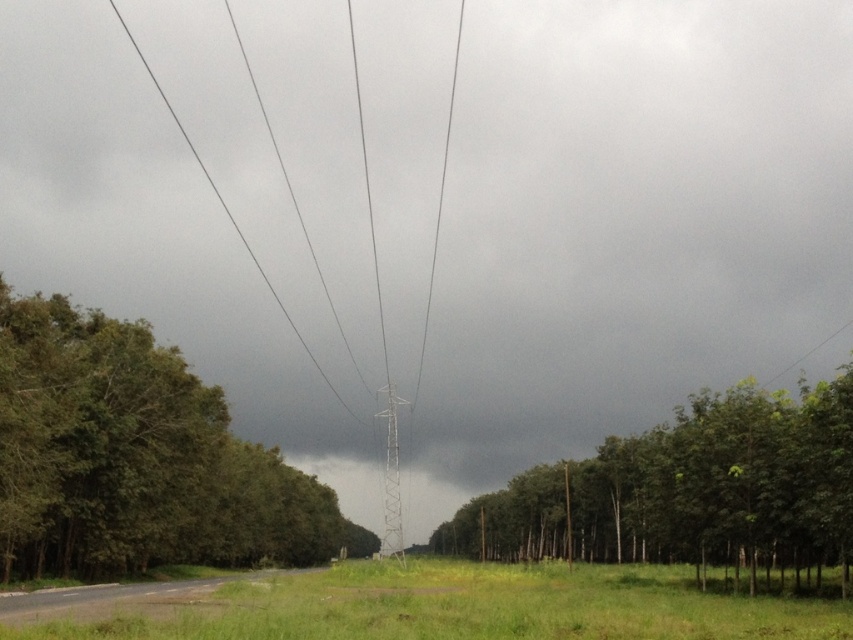
Question: Which point appears closest to the camera in this image?

Choices:
 (A) (93, 330)
 (B) (737, 406)

Answer: (B)

Question: Considering the relative positions of green leafy tree at left and green leafy trees at center in the image provided, where is green leafy tree at left located with respect to green leafy trees at center?

Choices:
 (A) below
 (B) above

Answer: (B)

Question: Can you confirm if green leafy tree at left is smaller than green grass at center?

Choices:
 (A) yes
 (B) no

Answer: (B)

Question: Which of the following is the farthest from the observer?

Choices:
 (A) pyautogui.click(x=648, y=589)
 (B) pyautogui.click(x=752, y=428)

Answer: (A)

Question: In this image, where is green leafy trees at center located relative to green grass at center?

Choices:
 (A) left
 (B) right

Answer: (B)

Question: Among these objects, which one is nearest to the camera?

Choices:
 (A) green leafy tree at left
 (B) green leafy trees at center

Answer: (B)